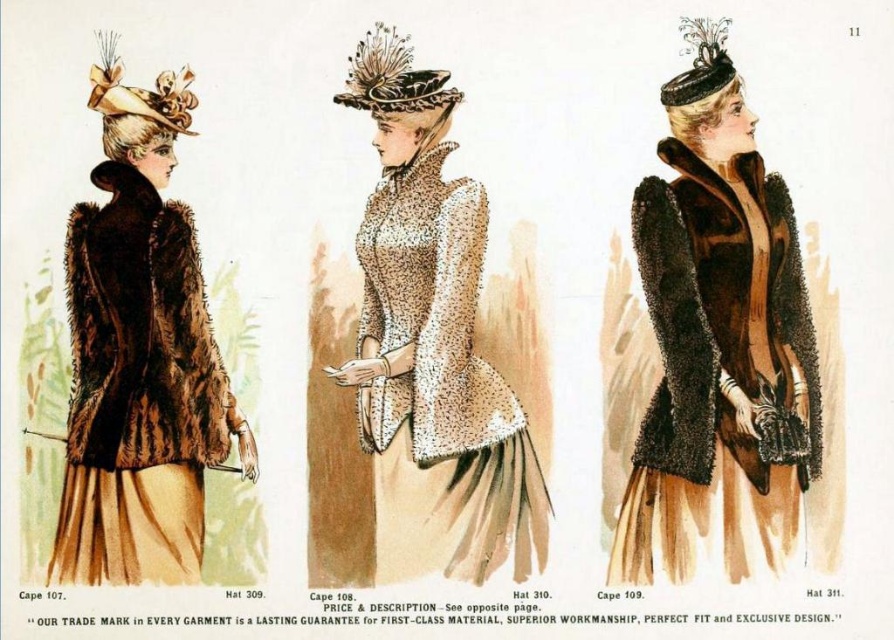
In the left panel of the vintage fashion illustration, there are two hats displayed on a woman. The first is a shiny black fabric hat at center, and the second is a black velvet hat at upper center. Which of these hats is positioned higher on the woman?

The black velvet hat at upper center is positioned higher than the shiny black fabric hat at center.

In the vintage fashion illustration, there are three women in panels. The left panel shows a woman from behind wearing a dark fur cape and holding a parasol. The middle and right panels have other outfits. You are an art student analyzing the illustration and notice the shiny black fabric hat at center. Where exactly is this hat located in the left panel?

The shiny black fabric hat at center is located at the coordinates point (x=392, y=77) in the left panel.